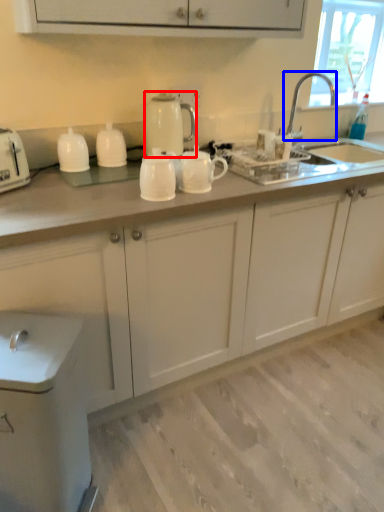
Question: Which point is closer to the camera, kitchen appliance (highlighted by a red box) or tap (highlighted by a blue box)?

Choices:
 (A) kitchen appliance
 (B) tap

Answer: (A)